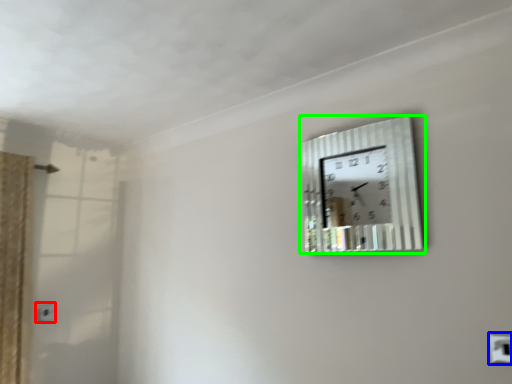
Question: Based on their relative distances, which object is nearer to electric outlet (highlighted by a red box)? Choose from electric outlet (highlighted by a blue box) and wall clock (highlighted by a green box).

Choices:
 (A) electric outlet
 (B) wall clock

Answer: (B)